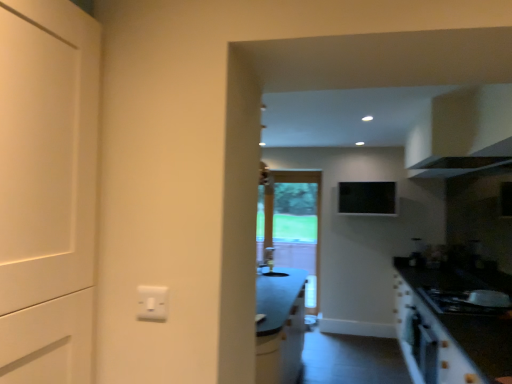
Question: From a real-world perspective, does black matte gas stove at lower right stand above white glossy cabinet at upper right?

Choices:
 (A) yes
 (B) no

Answer: (B)

Question: From the image's perspective, would you say black matte gas stove at lower right is shown under white glossy cabinet at upper right?

Choices:
 (A) no
 (B) yes

Answer: (B)

Question: Considering the relative positions of black matte gas stove at lower right and white glossy cabinet at upper right in the image provided, is black matte gas stove at lower right in front of white glossy cabinet at upper right?

Choices:
 (A) yes
 (B) no

Answer: (B)

Question: Is black matte gas stove at lower right located outside white glossy cabinet at upper right?

Choices:
 (A) yes
 (B) no

Answer: (A)

Question: Can you confirm if black matte gas stove at lower right is thinner than white glossy cabinet at upper right?

Choices:
 (A) yes
 (B) no

Answer: (A)

Question: From the image's perspective, would you say black matte gas stove at lower right is positioned over white glossy cabinet at upper right?

Choices:
 (A) no
 (B) yes

Answer: (A)

Question: Is clear glass screen door at center shorter than white glossy cabinet at upper right?

Choices:
 (A) no
 (B) yes

Answer: (A)

Question: Is clear glass screen door at center taller than white glossy cabinet at upper right?

Choices:
 (A) yes
 (B) no

Answer: (A)

Question: Could you tell me if clear glass screen door at center is turned towards white glossy cabinet at upper right?

Choices:
 (A) yes
 (B) no

Answer: (B)

Question: From the image's perspective, is clear glass screen door at center under white glossy cabinet at upper right?

Choices:
 (A) yes
 (B) no

Answer: (A)

Question: From a real-world perspective, is clear glass screen door at center physically above white glossy cabinet at upper right?

Choices:
 (A) yes
 (B) no

Answer: (B)

Question: Are clear glass screen door at center and white glossy cabinet at upper right making contact?

Choices:
 (A) yes
 (B) no

Answer: (B)

Question: Is clear glass screen door at center aimed at white glossy sink at center?

Choices:
 (A) yes
 (B) no

Answer: (A)